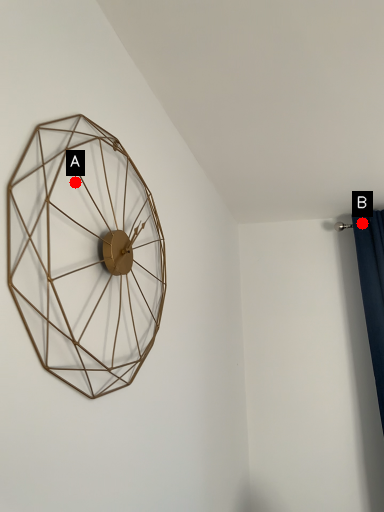
Question: Two points are circled on the image, labeled by A and B beside each circle. Which point appears closest to the camera in this image?

Choices:
 (A) A is closer
 (B) B is closer

Answer: (A)